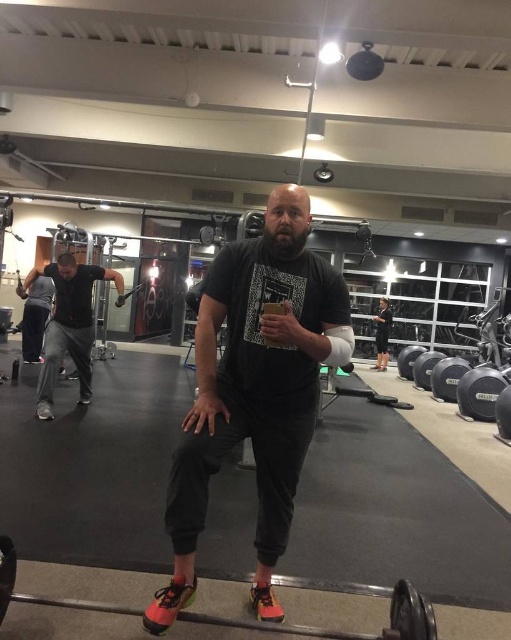
You are standing in the gym and need to locate the black rubber barbell at center. Based on the coordinates provided, where exactly would you find it in the image?

The black rubber barbell at center is located at the coordinates point (347,632) in the image.